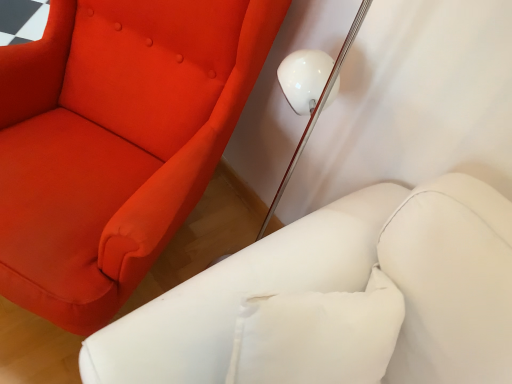
Describe the element at coordinates (338, 299) in the screenshot. This screenshot has height=384, width=512. I see `white leather armchair at lower right` at that location.

Where is `white leather armchair at lower right`? The image size is (512, 384). white leather armchair at lower right is located at coordinates (338, 299).

Measure the distance between point [148,334] and camera.

Point [148,334] and camera are 27.72 inches apart.

What are the coordinates of `matte red fabric chair at upper left` in the screenshot? It's located at (115, 141).

What do you see at coordinates (115, 141) in the screenshot?
I see `matte red fabric chair at upper left` at bounding box center [115, 141].

Locate an element on the screen. Image resolution: width=512 pixels, height=384 pixels. white leather armchair at lower right is located at coordinates coord(338,299).

Which object is positioned more to the left, white leather armchair at lower right or matte red fabric chair at upper left?

matte red fabric chair at upper left is more to the left.

Which is in front, white leather armchair at lower right or matte red fabric chair at upper left?

white leather armchair at lower right is in front.

Which is behind, point (384, 324) or point (93, 143)?

The point (93, 143) is behind.

From the image's perspective, between white leather armchair at lower right and matte red fabric chair at upper left, which one is located above?

matte red fabric chair at upper left.

From a real-world perspective, who is located lower, white leather armchair at lower right or matte red fabric chair at upper left?

matte red fabric chair at upper left, from a real-world perspective.

Looking at their sizes, would you say white leather armchair at lower right is wider or thinner than matte red fabric chair at upper left?

In the image, white leather armchair at lower right appears to be more narrow than matte red fabric chair at upper left.

Is white leather armchair at lower right shorter than matte red fabric chair at upper left?

Correct, white leather armchair at lower right is not as tall as matte red fabric chair at upper left.

Is white leather armchair at lower right bigger than matte red fabric chair at upper left?

No, white leather armchair at lower right is not bigger than matte red fabric chair at upper left.

From the picture: Is white leather armchair at lower right completely or partially outside of matte red fabric chair at upper left?

white leather armchair at lower right lies outside matte red fabric chair at upper left's area.

Is white leather armchair at lower right with matte red fabric chair at upper left?

No, white leather armchair at lower right is not making contact with matte red fabric chair at upper left.

Does white leather armchair at lower right turn towards matte red fabric chair at upper left?

No, white leather armchair at lower right is not turned towards matte red fabric chair at upper left.

In the scene shown: How many degrees apart are the facing directions of white leather armchair at lower right and matte red fabric chair at upper left?

The angle between the facing direction of white leather armchair at lower right and the facing direction of matte red fabric chair at upper left is 54.2 degrees.

At what (x,y) coordinates should I click in order to perform the action: click on furniture that is in front of the matte red fabric chair at upper left. Please return your answer as a coordinate pair (x, y). This screenshot has width=512, height=384. Looking at the image, I should click on (338, 299).

Is matte red fabric chair at upper left to the left of white leather armchair at lower right from the viewer's perspective?

Yes.

Which object is further away from the camera taking this photo, matte red fabric chair at upper left or white leather armchair at lower right?

matte red fabric chair at upper left is more distant.

Considering the positions of points (200, 109) and (213, 341), is point (200, 109) closer to camera compared to point (213, 341)?

No, (200, 109) is behind (213, 341).

From the image's perspective, is matte red fabric chair at upper left located above or below white leather armchair at lower right?

Based on their image positions, matte red fabric chair at upper left is located above white leather armchair at lower right.

From a real-world perspective, between matte red fabric chair at upper left and white leather armchair at lower right, who is vertically lower?

In real-world perspective, matte red fabric chair at upper left is lower.

Considering the relative sizes of matte red fabric chair at upper left and white leather armchair at lower right in the image provided, is matte red fabric chair at upper left thinner than white leather armchair at lower right?

Incorrect, the width of matte red fabric chair at upper left is not less than that of white leather armchair at lower right.

Does matte red fabric chair at upper left have a lesser height compared to white leather armchair at lower right?

No.

Which of these two, matte red fabric chair at upper left or white leather armchair at lower right, is smaller?

With smaller size is white leather armchair at lower right.

Is white leather armchair at lower right surrounded by matte red fabric chair at upper left?

No.

Is the surface of matte red fabric chair at upper left in direct contact with white leather armchair at lower right?

There is a gap between matte red fabric chair at upper left and white leather armchair at lower right.

Is white leather armchair at lower right at the back of matte red fabric chair at upper left?

No, matte red fabric chair at upper left is not facing the opposite direction of white leather armchair at lower right.

Measure the distance between matte red fabric chair at upper left and white leather armchair at lower right.

matte red fabric chair at upper left is 19.01 inches away from white leather armchair at lower right.

You are a GUI agent. You are given a task and a screenshot of the screen. Output one action in this format:
    pyautogui.click(x=<x>, y=<y>)
    Task: Click on the chair to the left of white leather armchair at lower right
    The width and height of the screenshot is (512, 384).
    Given the screenshot: What is the action you would take?
    pyautogui.click(x=115, y=141)

This screenshot has height=384, width=512. I want to click on chair beneath the white leather armchair at lower right (from a real-world perspective), so click(x=115, y=141).

Identify the location of furniture that appears below the matte red fabric chair at upper left (from the image's perspective). (338, 299).